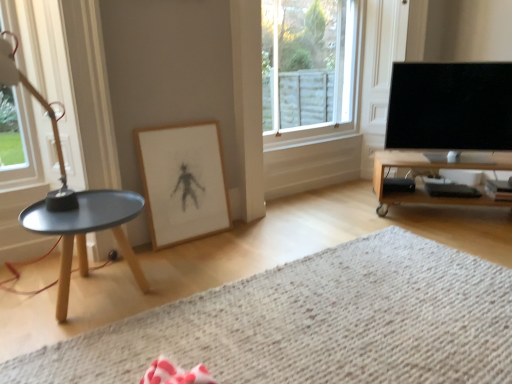
Question: Does black glossy tv at right have a greater height compared to clear glass window at upper center, which is counted as the first window, starting from the right?

Choices:
 (A) yes
 (B) no

Answer: (B)

Question: Considering the relative sizes of black glossy tv at right and clear glass window at upper center, positioned as the 2th window in left-to-right order, in the image provided, is black glossy tv at right wider than clear glass window at upper center, positioned as the 2th window in left-to-right order,?

Choices:
 (A) yes
 (B) no

Answer: (A)

Question: Is black glossy tv at right facing towards clear glass window at upper center, which is counted as the first window, starting from the right?

Choices:
 (A) yes
 (B) no

Answer: (B)

Question: Are black glossy tv at right and clear glass window at upper center, which is counted as the first window, starting from the right, far apart?

Choices:
 (A) yes
 (B) no

Answer: (B)

Question: Is black glossy tv at right closer to camera compared to clear glass window at upper center, marked as the 2th window in a front-to-back arrangement?

Choices:
 (A) yes
 (B) no

Answer: (A)

Question: From the image's perspective, is clear glass window at left, positioned as the first window in front-to-back order, positioned above or below clear glass window at upper center, positioned as the 2th window in left-to-right order?

Choices:
 (A) below
 (B) above

Answer: (A)

Question: In the image, is clear glass window at left, placed as the second window when sorted from back to front, on the left side or the right side of clear glass window at upper center, marked as the 2th window in a front-to-back arrangement?

Choices:
 (A) right
 (B) left

Answer: (B)

Question: Considering the positions of clear glass window at left, positioned as the first window in front-to-back order, and clear glass window at upper center, marked as the 2th window in a front-to-back arrangement, in the image, is clear glass window at left, positioned as the first window in front-to-back order, bigger or smaller than clear glass window at upper center, marked as the 2th window in a front-to-back arrangement,?

Choices:
 (A) small
 (B) big

Answer: (A)

Question: Is clear glass window at left, positioned as the first window in front-to-back order, inside the boundaries of clear glass window at upper center, the first window viewed from the back, or outside?

Choices:
 (A) inside
 (B) outside

Answer: (B)

Question: Considering their positions, is wooden tv stand at right located in front of or behind black glossy tv at right?

Choices:
 (A) behind
 (B) front

Answer: (A)

Question: Looking at their shapes, would you say wooden tv stand at right is wider or thinner than black glossy tv at right?

Choices:
 (A) thin
 (B) wide

Answer: (B)

Question: From the image's perspective, relative to black glossy tv at right, is wooden tv stand at right above or below?

Choices:
 (A) below
 (B) above

Answer: (A)

Question: Is wooden tv stand at right bigger or smaller than black glossy tv at right?

Choices:
 (A) small
 (B) big

Answer: (B)

Question: Is wooden tv stand at right situated inside clear glass window at upper center, marked as the 2th window in a front-to-back arrangement, or outside?

Choices:
 (A) outside
 (B) inside

Answer: (A)

Question: From their relative heights in the image, would you say wooden tv stand at right is taller or shorter than clear glass window at upper center, positioned as the 2th window in left-to-right order?

Choices:
 (A) tall
 (B) short

Answer: (B)